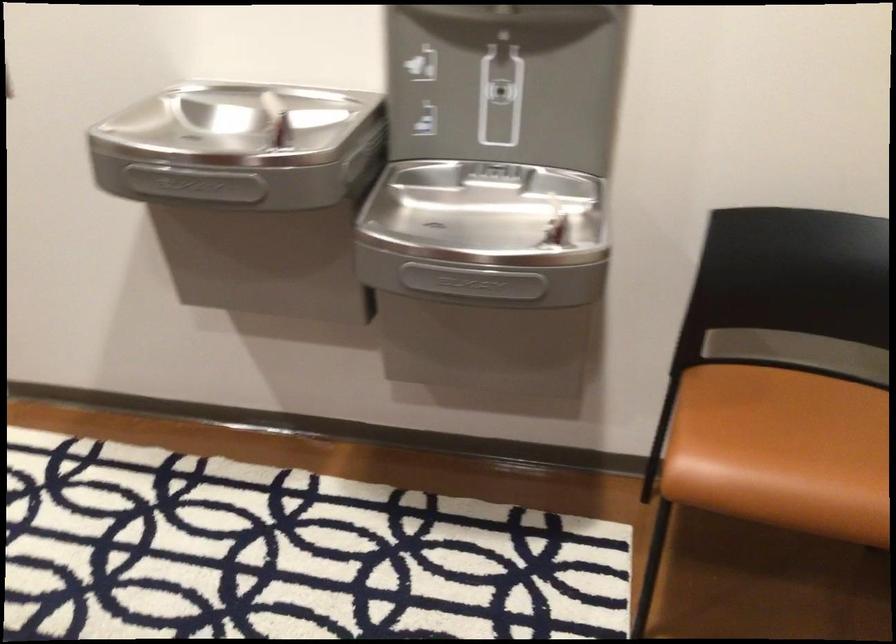
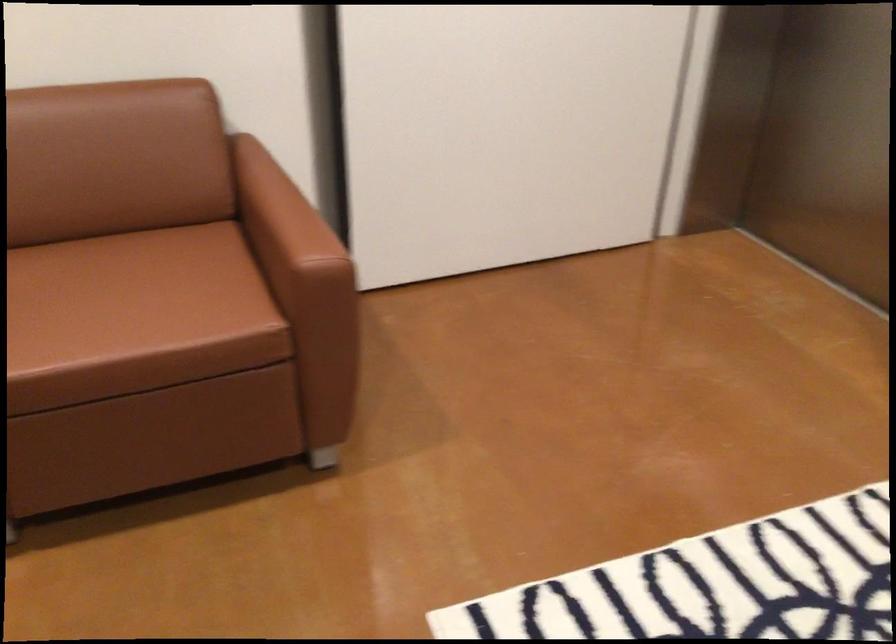
The first image is from the beginning of the video and the second image is from the end. How did the camera likely rotate when shooting the video?

The rotation direction of the camera is left-down.